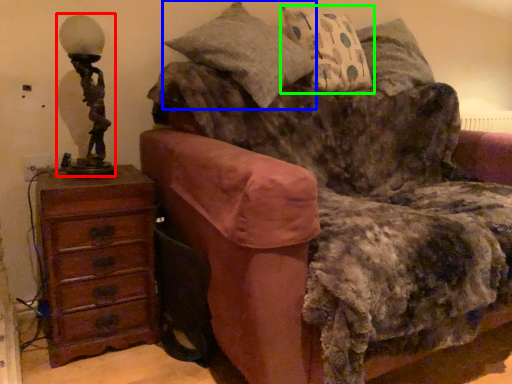
Question: Which object is positioned closest to table lamp (highlighted by a red box)? Select from pillow (highlighted by a blue box) and pillow (highlighted by a green box).

Choices:
 (A) pillow
 (B) pillow

Answer: (A)